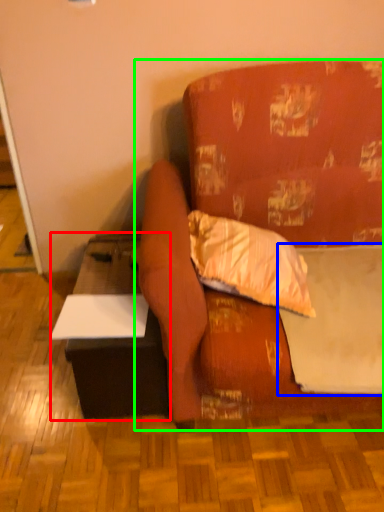
Question: Which object is the closest to the table (highlighted by a red box)? Choose among these: sheet (highlighted by a blue box) or studio couch (highlighted by a green box).

Choices:
 (A) sheet
 (B) studio couch

Answer: (B)